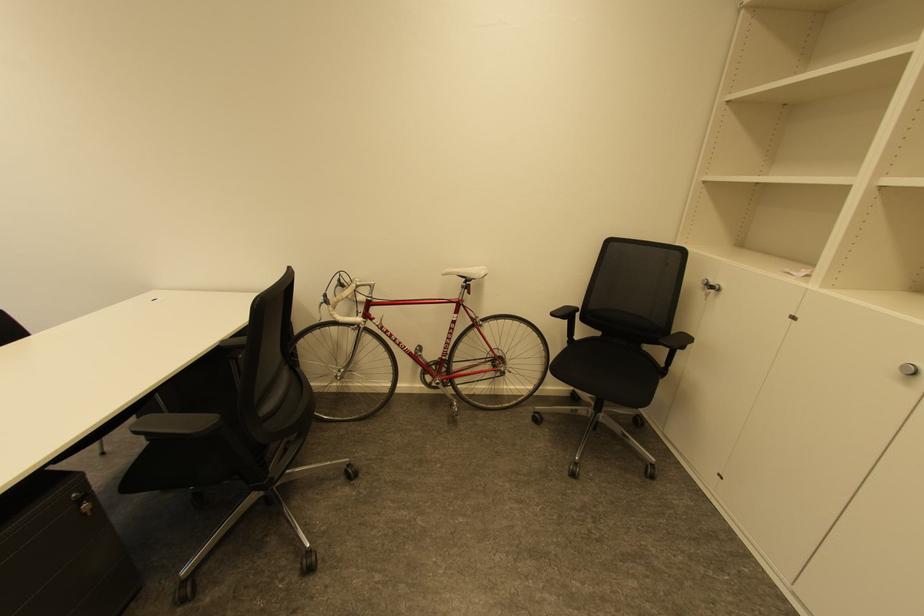
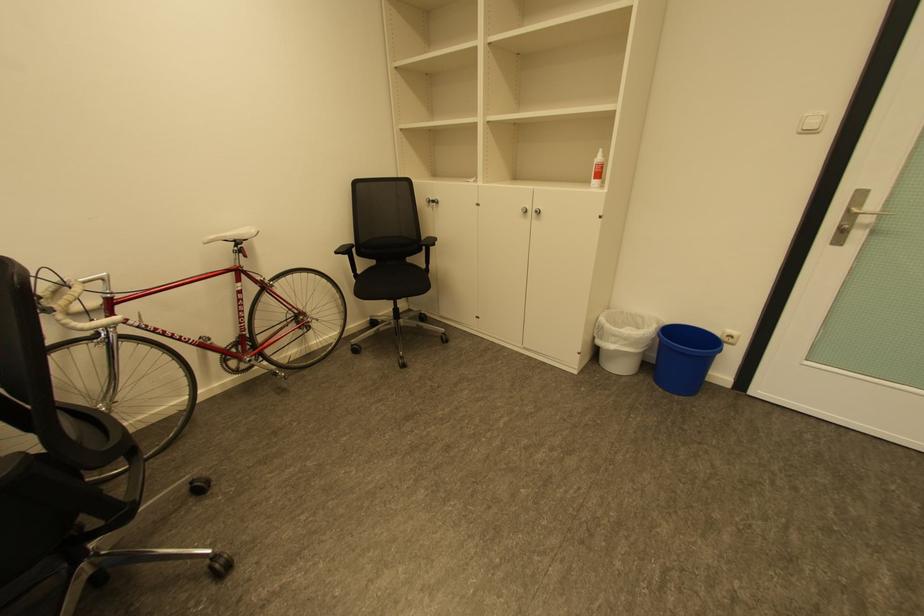
The point at (663, 353) is marked in the first image. Where is the corresponding point in the second image?

(426, 259)